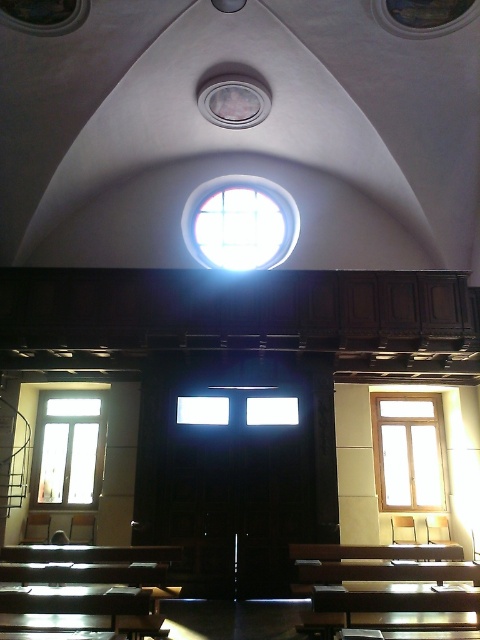
Question: Which object is the farthest from the clear glass window at left?

Choices:
 (A) clear glass window at center
 (B) clear glass window at right

Answer: (B)

Question: Among these points, which one is farthest from the camera?

Choices:
 (A) (274, 200)
 (B) (396, 403)

Answer: (A)

Question: Is clear glass window at right smaller than clear glass window at left?

Choices:
 (A) yes
 (B) no

Answer: (B)

Question: Is clear glass window at center above clear glass window at left?

Choices:
 (A) no
 (B) yes

Answer: (B)

Question: Among these points, which one is nearest to the camera?

Choices:
 (A) (384, 408)
 (B) (70, 422)

Answer: (A)

Question: Does clear glass window at right appear on the right side of clear glass window at left?

Choices:
 (A) yes
 (B) no

Answer: (A)